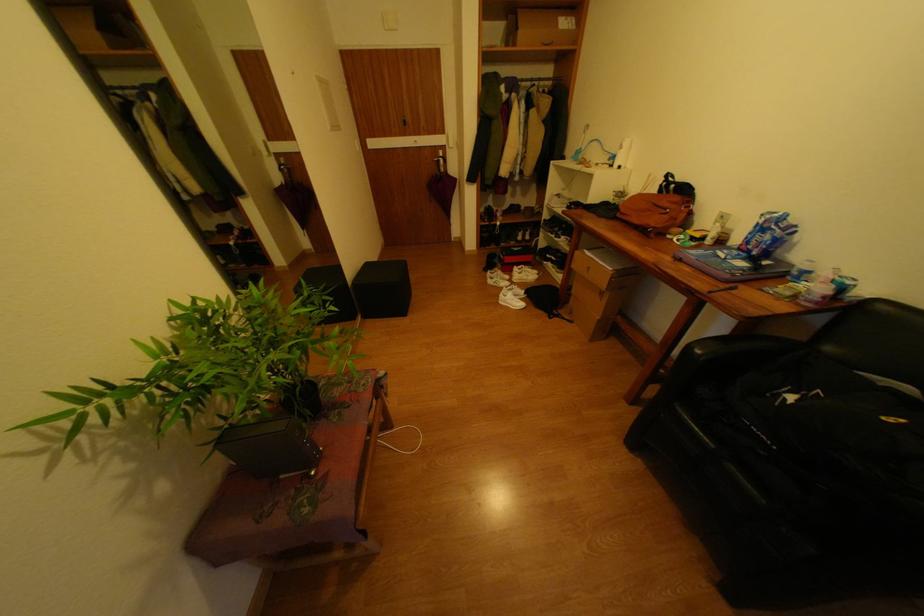
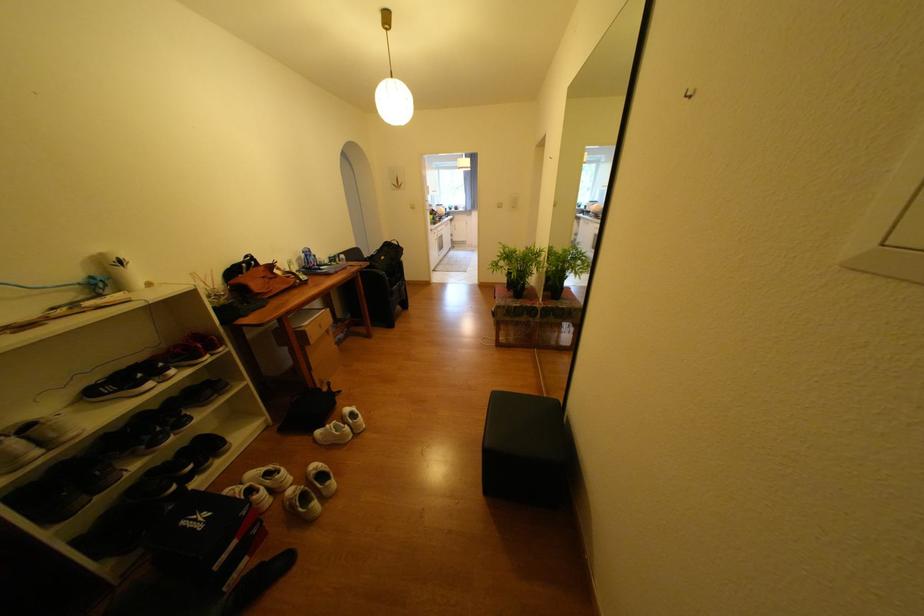
The point at [686,199] is marked in the first image. Where is the corresponding point in the second image?

(271, 269)